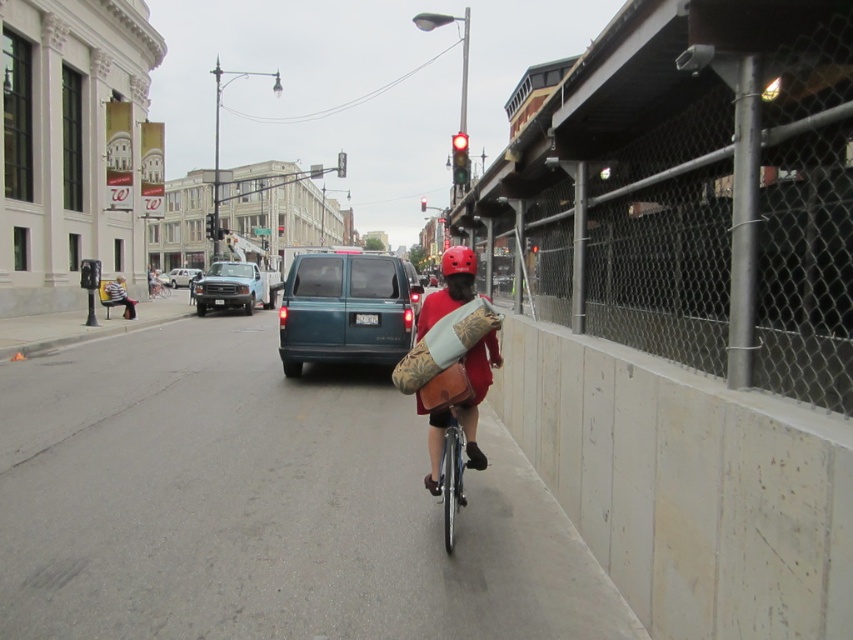
Locate an element on the screen. The width and height of the screenshot is (853, 640). matte blue truck at center is located at coordinates (234, 288).

Does point (270, 296) come farther from viewer compared to point (462, 262)?

Yes, point (270, 296) is behind point (462, 262).

The height and width of the screenshot is (640, 853). Identify the location of matte blue truck at center. (234, 288).

Image resolution: width=853 pixels, height=640 pixels. I want to click on teal matte van at center, so click(346, 308).

Which is in front, point (299, 275) or point (276, 276)?

Point (299, 275) is in front.

Image resolution: width=853 pixels, height=640 pixels. Find the location of `teal matte van at center`. teal matte van at center is located at coordinates (346, 308).

Does smooth concrete bike lane at center have a smaller size compared to white matte van at center?

Indeed, smooth concrete bike lane at center has a smaller size compared to white matte van at center.

Consider the image. Which of these two, smooth concrete bike lane at center or white matte van at center, stands shorter?

smooth concrete bike lane at center

This screenshot has width=853, height=640. I want to click on smooth concrete bike lane at center, so click(262, 506).

Find the location of a particular element. smooth concrete bike lane at center is located at coordinates (x=262, y=506).